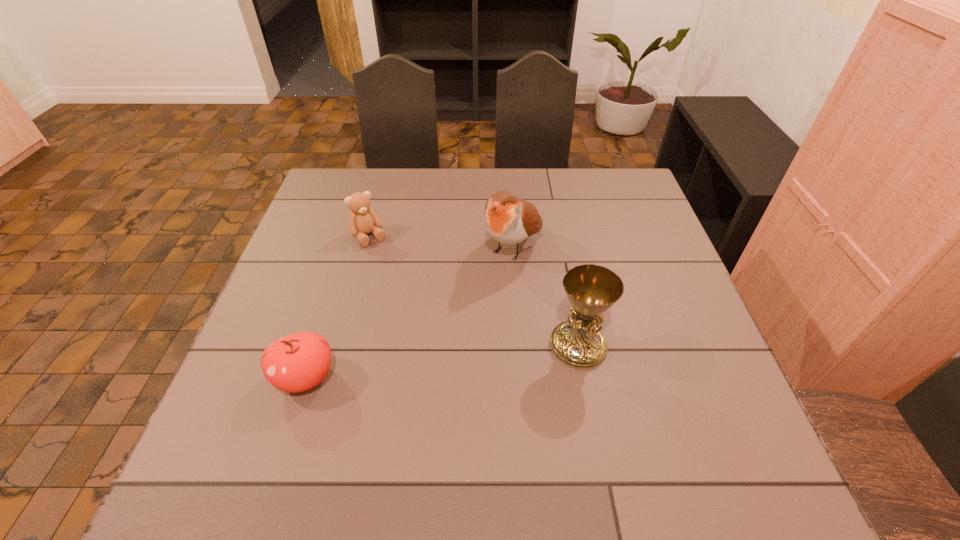
Image resolution: width=960 pixels, height=540 pixels. Find the location of `free spot located 0.090m at the face of the bird`. free spot located 0.090m at the face of the bird is located at coordinates (482, 294).

In order to click on vacant space located at the face of the bird in this screenshot , I will do `click(409, 390)`.

Where is `object present at the near edge`? This screenshot has height=540, width=960. object present at the near edge is located at coordinates (298, 362).

Where is `apple at the left edge`? Image resolution: width=960 pixels, height=540 pixels. apple at the left edge is located at coordinates (298, 362).

This screenshot has width=960, height=540. Identify the location of teddy bear located in the left edge section of the desktop. (363, 220).

I want to click on object present at the near left corner, so click(x=298, y=362).

I want to click on vacant area at the far edge, so click(x=580, y=192).

Identify the location of vacant region at the near edge. This screenshot has height=540, width=960. (444, 402).

I want to click on free space at the left edge of the desktop, so click(230, 383).

Locate an element on the screen. The width and height of the screenshot is (960, 540). free space at the right edge of the desktop is located at coordinates (646, 295).